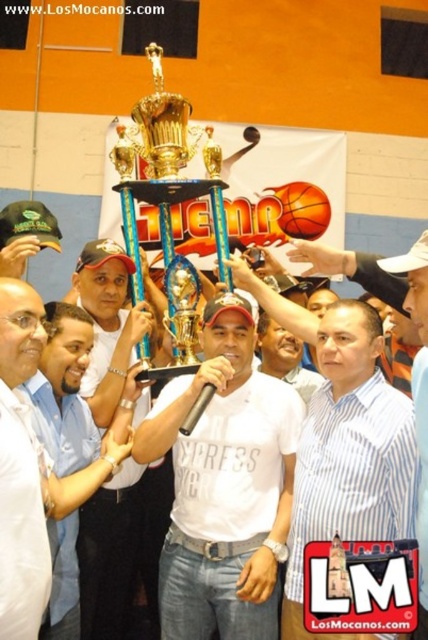
Does white striped shirt at center have a lesser height compared to matte black cap at center?

Yes, white striped shirt at center is shorter than matte black cap at center.

Is white striped shirt at center positioned behind matte black cap at center?

No, white striped shirt at center is in front of matte black cap at center.

Between point (344, 307) and point (127, 362), which one is positioned behind?

The point (127, 362) is behind.

You are a GUI agent. You are given a task and a screenshot of the screen. Output one action in this format:
    pyautogui.click(x=<x>, y=<y>)
    Task: Click on the white striped shirt at center
    
    Given the screenshot: What is the action you would take?
    350,454

Is striped shirt at center wider than gold shiny trophy at center?

In fact, striped shirt at center might be narrower than gold shiny trophy at center.

Is striped shirt at center in front of gold shiny trophy at center?

Yes, it is.

What do you see at coordinates (418, 396) in the screenshot? I see `striped shirt at center` at bounding box center [418, 396].

The height and width of the screenshot is (640, 428). I want to click on striped shirt at center, so click(x=418, y=396).

Is white matte t-shirt at center thinner than metallic trophy at center?

Correct, white matte t-shirt at center's width is less than metallic trophy at center's.

Which is above, white matte t-shirt at center or metallic trophy at center?

metallic trophy at center is above.

Who is more forward, (214,520) or (255,280)?

Point (214,520) is more forward.

This screenshot has height=640, width=428. In order to click on white matte t-shirt at center in this screenshot , I will do `click(225, 486)`.